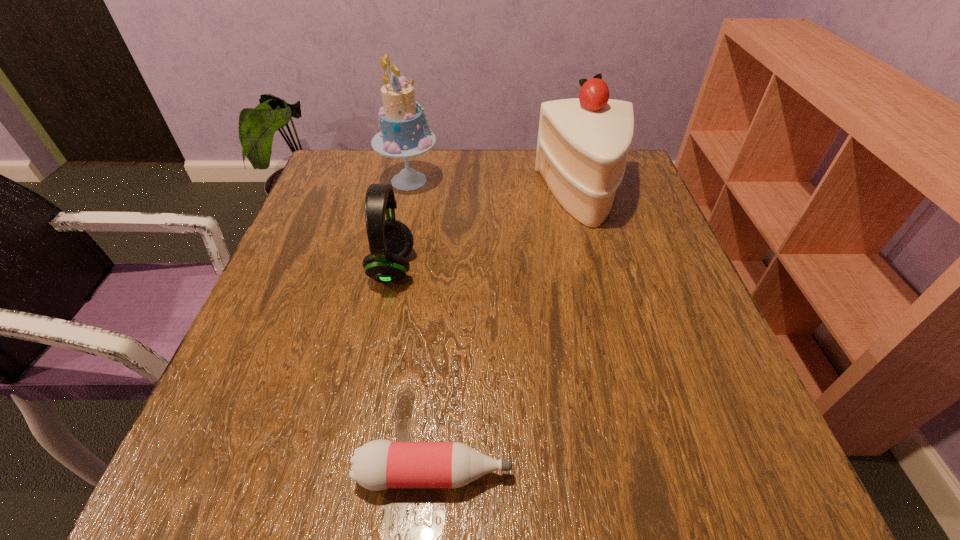
The height and width of the screenshot is (540, 960). In the image, there is a desktop. Find the location of `free space at the right edge`. free space at the right edge is located at coordinates (661, 350).

The width and height of the screenshot is (960, 540). I want to click on vacant space at the far left corner, so click(x=341, y=167).

The image size is (960, 540). What are the coordinates of `free space at the near left corner of the desktop` in the screenshot? It's located at (226, 456).

Locate an element on the screen. This screenshot has height=540, width=960. blank area at the far right corner is located at coordinates (636, 197).

Find the location of a particular element. The image size is (960, 540). vacant area at the near right corner of the desktop is located at coordinates (760, 504).

You are a GUI agent. You are given a task and a screenshot of the screen. Output one action in this format:
    pyautogui.click(x=<x>, y=<y>)
    Task: Click on the free point between the bottle and the left cake
    The image size is (960, 540).
    Given the screenshot: What is the action you would take?
    pyautogui.click(x=421, y=327)

The width and height of the screenshot is (960, 540). Find the location of `free spot between the right cake and the nearest object`. free spot between the right cake and the nearest object is located at coordinates (509, 335).

You are a GUI agent. You are given a task and a screenshot of the screen. Output one action in this format:
    pyautogui.click(x=<x>, y=<y>)
    Task: Click on the free space between the shortest object and the taller cake
    
    Given the screenshot: What is the action you would take?
    pyautogui.click(x=421, y=327)

I want to click on vacant point located between the right cake and the headset, so click(488, 233).

Where is `vacant space that's between the second nearest object and the shortest object`? The height and width of the screenshot is (540, 960). vacant space that's between the second nearest object and the shortest object is located at coordinates (413, 372).